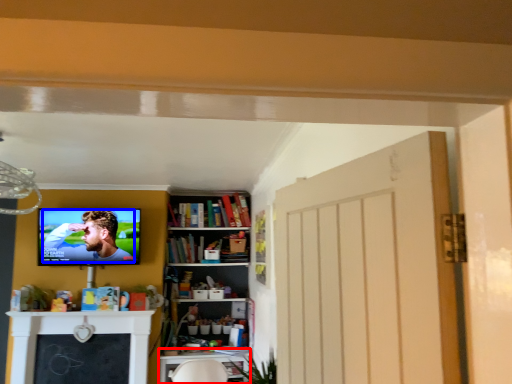
Question: Which point is further to the camera, table (highlighted by a red box) or person (highlighted by a blue box)?

Choices:
 (A) table
 (B) person

Answer: (A)